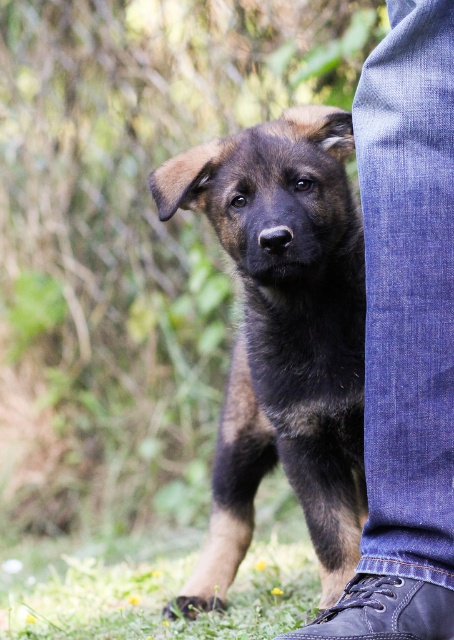
Can you confirm if brown fur puppy at center is positioned to the right of green grass at lower center?

Correct, you'll find brown fur puppy at center to the right of green grass at lower center.

Is point (351, 531) closer to viewer compared to point (92, 598)?

Yes, point (351, 531) is closer to viewer.

Locate an element on the screen. The width and height of the screenshot is (454, 640). brown fur puppy at center is located at coordinates coord(284,337).

Does brown fur puppy at center appear on the right side of leather shoe at lower center?

In fact, brown fur puppy at center is to the left of leather shoe at lower center.

Does brown fur puppy at center have a lesser width compared to leather shoe at lower center?

No.

Is point (253, 195) behind point (391, 636)?

That is True.

Locate an element on the screen. The height and width of the screenshot is (640, 454). brown fur puppy at center is located at coordinates (284, 337).

From the picture: Who is shorter, denim pants at lower right or green grass at lower center?

green grass at lower center is shorter.

Measure the distance between denim pants at lower right and camera.

They are 1.56 meters apart.

Between point (409, 362) and point (43, 554), which one is positioned behind?

The point (43, 554) is more distant.

Locate an element on the screen. denim pants at lower right is located at coordinates (404, 336).